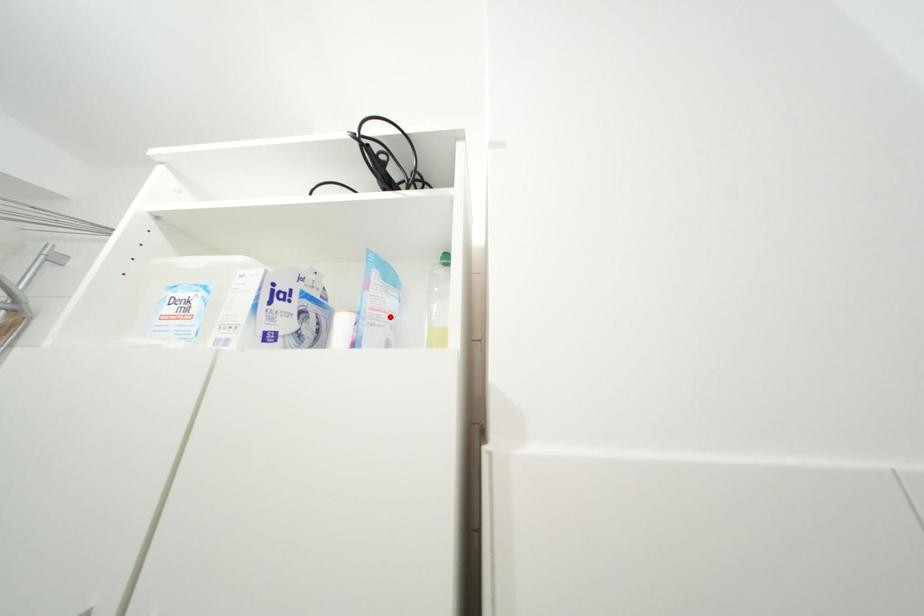
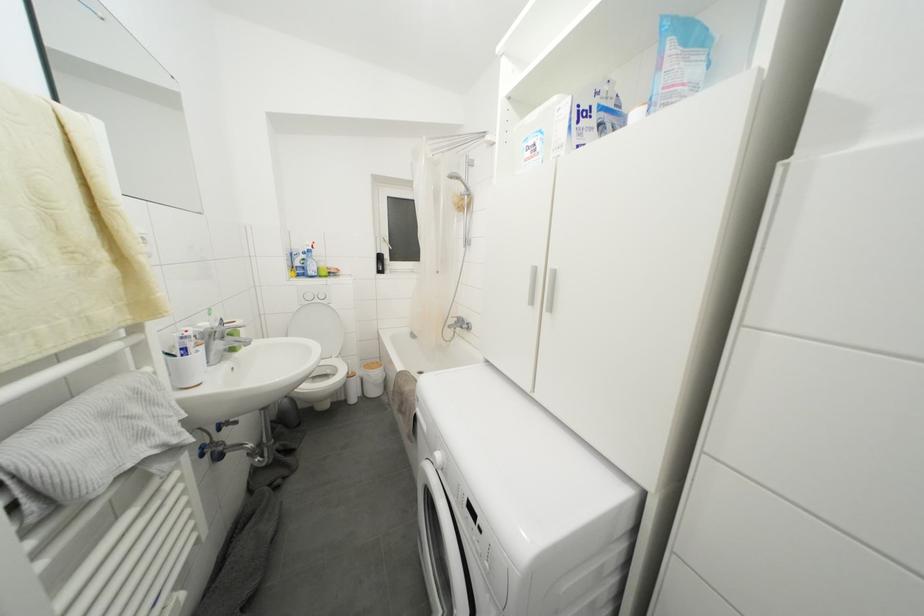
Where in the second image is the point corresponding to the highlighted location from the first image?

(687, 89)